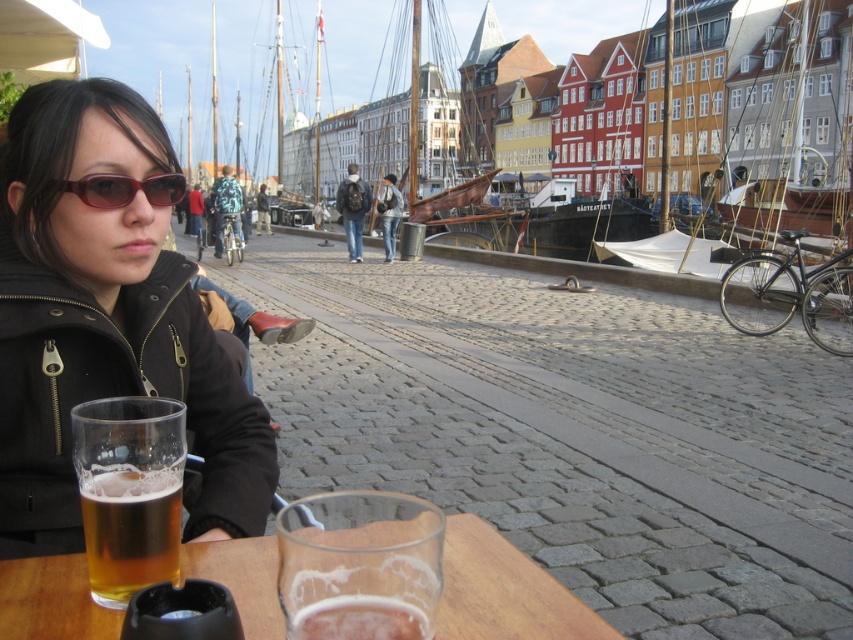
Is matte black jacket at lower left smaller than matte red sunglasses at upper left?

Actually, matte black jacket at lower left might be larger than matte red sunglasses at upper left.

Between point (114, 333) and point (154, 179), which one is positioned in front?

Point (114, 333)

Identify the location of matte black jacket at lower left. The height and width of the screenshot is (640, 853). (105, 321).

Does clear glass table at center appear over matte red sunglasses at upper left?

No, clear glass table at center is not above matte red sunglasses at upper left.

How much distance is there between clear glass table at center and matte red sunglasses at upper left?

2.23 meters

Who is more forward, [45,637] or [173,179]?

Point [45,637] is more forward.

Locate an element on the screen. This screenshot has height=640, width=853. clear glass table at center is located at coordinates (503, 592).

Which of these two, foamy amber beer at lower center or matte red sunglasses at upper left, stands taller?

matte red sunglasses at upper left is taller.

This screenshot has height=640, width=853. Identify the location of foamy amber beer at lower center. (360, 620).